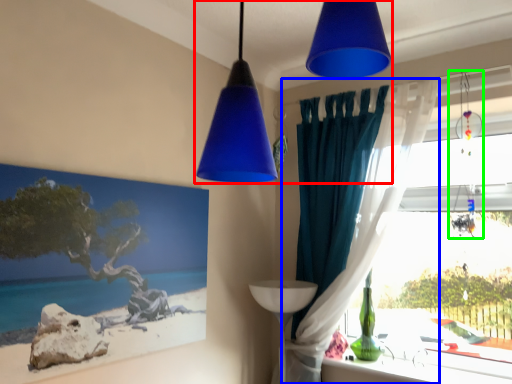
Question: Based on their relative distances, which object is nearer to lamp (highlighted by a red box)? Choose from curtain (highlighted by a blue box) and lamp (highlighted by a green box).

Choices:
 (A) curtain
 (B) lamp

Answer: (A)